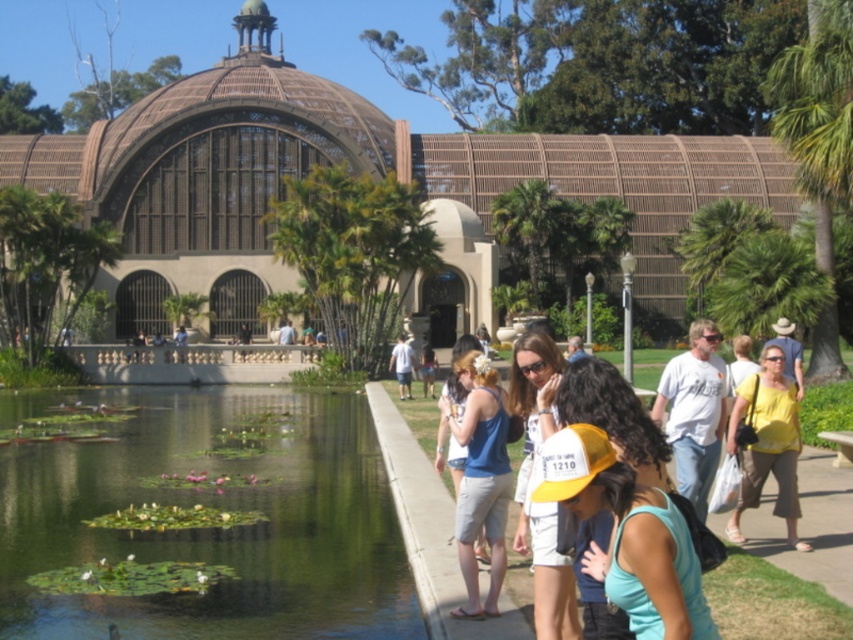
You are a photographer standing on the walkway near the pond. You want to take a photo of both the blue denim shorts at center and the yellow cotton shirt at right. Which object should you focus on first if you want to ensure both are in sharp focus?

The blue denim shorts at center is taller than the yellow cotton shirt at right, so you should focus on the blue denim shorts at center first to ensure both are in sharp focus.